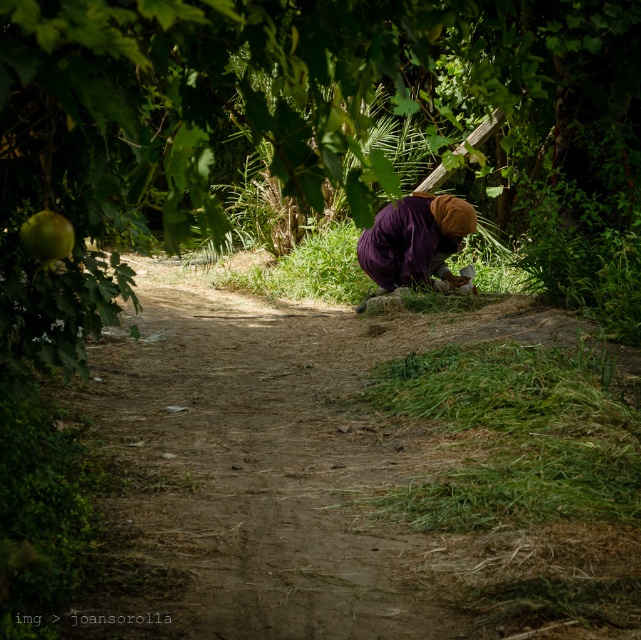
Question: Does green leafy tree at center have a lesser width compared to green matte apple at upper left?

Choices:
 (A) no
 (B) yes

Answer: (A)

Question: Considering the real-world distances, which object is closest to the green matte apple at upper left?

Choices:
 (A) green leafy tree at center
 (B) purple fabric at center
 (C) dirt path at center

Answer: (C)

Question: Based on their relative distances, which object is farther from the dirt path at center?

Choices:
 (A) green matte apple at upper left
 (B) purple fabric at center
 (C) green leafy tree at center

Answer: (C)

Question: Is dirt path at center to the right of purple fabric at center from the viewer's perspective?

Choices:
 (A) no
 (B) yes

Answer: (A)

Question: Is dirt path at center thinner than purple fabric at center?

Choices:
 (A) no
 (B) yes

Answer: (B)

Question: Which object appears closest to the camera in this image?

Choices:
 (A) green leafy tree at center
 (B) green matte apple at upper left
 (C) purple fabric at center
 (D) dirt path at center

Answer: (A)